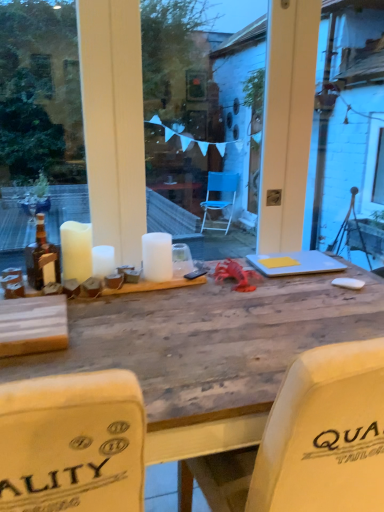
Question: Considering the positions of matte brown bottle at left and white matte candle at center, which appears as the 3th candle when viewed from the left, in the image, is matte brown bottle at left bigger or smaller than white matte candle at center, which appears as the 3th candle when viewed from the left,?

Choices:
 (A) big
 (B) small

Answer: (A)

Question: Looking at their shapes, would you say matte brown bottle at left is wider or thinner than white matte candle at center, which appears as the 3th candle when viewed from the left?

Choices:
 (A) wide
 (B) thin

Answer: (A)

Question: Which is farther from the white matte candle at left, acting as the third candle starting from the right?

Choices:
 (A) transparent glass window at center
 (B) white matte candle at center, marked as the 2th candle in a right-to-left arrangement
 (C) matte brown bottle at left
 (D) white matte candle at center, which appears as the 3th candle when viewed from the left
 (E) wooden table at center

Answer: (A)

Question: Based on their relative distances, which object is farther from the transparent glass window at center?

Choices:
 (A) wooden table at center
 (B) white matte candle at center, which is counted as the second candle, starting from the left
 (C) white matte candle at left, acting as the third candle starting from the right
 (D) yellow paper at center
 (E) white matte candle at center, which appears as the 3th candle when viewed from the left

Answer: (B)